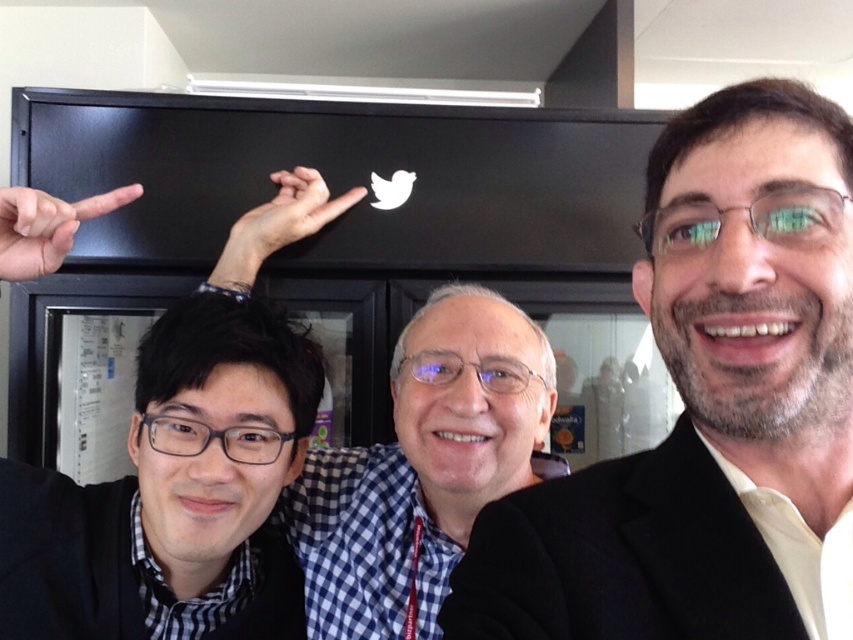
You are a security guard in the Twitter office. You need to check the lanyard of the person whose matte black finger at left is pointing at the Twitter logo. The smooth black suit at right is blocking your path. Can you reach the person without moving the suit?

The distance between smooth black suit at right and matte black finger at left is 57.43 centimeters. Since the smooth black suit is blocking your path, you would need to move around it or ask the person to step aside to access the lanyard.

You are a security guard at Twitter. You see the black matte laptop at upper left and the matte black finger at left in the image. Which object is closer to the left edge of the image?

The matte black finger at left is closer to the left edge of the image because the black matte laptop at upper left is to the right of it.

You are a photographer trying to capture a group photo of the three individuals in the scene. You notice two black objects in the image, the matte black hand at center and the matte black finger at left. Which of these two objects is wider?

The matte black hand at center is wider than the matte black finger at left because the matte black hand at center has a greater width according to the description.